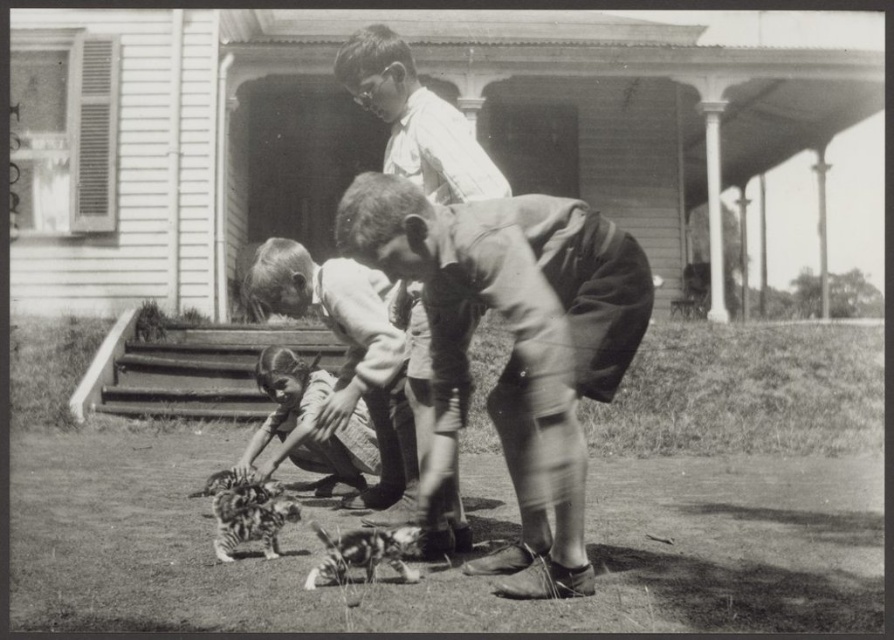
Consider the image. You are a photographer standing at the bottom of the porch steps. You want to take a photo of the smooth fabric dress at center without moving the dress. What is the minimum distance you need to move forward to ensure the dress is in focus?

The minimum distance you need to move forward is 4.67 meters to ensure the smooth fabric dress at center is in focus.

You are standing at the point marked as point [401,259] in the image. You want to walk towards the house. Is the house in front of you or behind you?

The house is in front of you because you are 11.88 feet away from the viewer, indicating that the house is located in the direction you are facing.